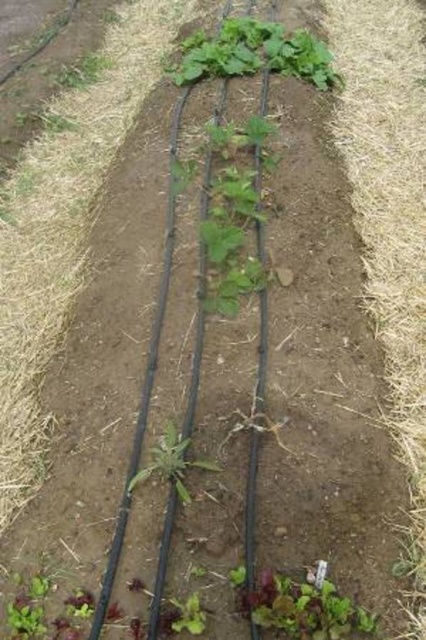
Question: Which object appears farthest from the camera in this image?

Choices:
 (A) green leafy plant at upper center
 (B) green leafy lettuce at lower center

Answer: (A)

Question: Which of these objects is positioned closest to the green leafy plant at center?

Choices:
 (A) green leafy at center
 (B) green leafy lettuce at lower center
 (C) brown straw at right

Answer: (A)

Question: From the image, what is the correct spatial relationship of green leafy lettuce at lower center in relation to green leafy plant at center?

Choices:
 (A) left
 (B) right

Answer: (B)

Question: Does green leafy plant at center appear over green leafy at center?

Choices:
 (A) no
 (B) yes

Answer: (B)

Question: Can you confirm if green leafy plant at upper center is smaller than green leafy plant at center?

Choices:
 (A) yes
 (B) no

Answer: (B)

Question: Which point appears closest to the camera in this image?

Choices:
 (A) 405,60
 (B) 169,456

Answer: (B)